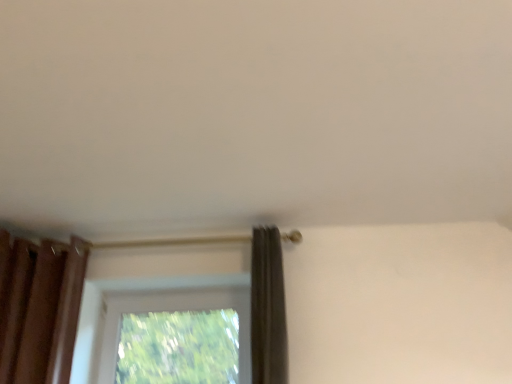
Measure the distance between transparent glass window at center and camera.

transparent glass window at center and camera are 1.99 meters apart.

In order to face transparent glass window at center, should I rotate leftwards or rightwards?

Turn left by 10.502 degrees to look at transparent glass window at center.

The height and width of the screenshot is (384, 512). What do you see at coordinates (174, 336) in the screenshot? I see `transparent glass window at center` at bounding box center [174, 336].

You are a GUI agent. You are given a task and a screenshot of the screen. Output one action in this format:
    pyautogui.click(x=<x>, y=<y>)
    Task: Click on the transparent glass window at center
    
    Given the screenshot: What is the action you would take?
    pyautogui.click(x=174, y=336)

Identify the location of transparent glass window at center. [x=174, y=336].